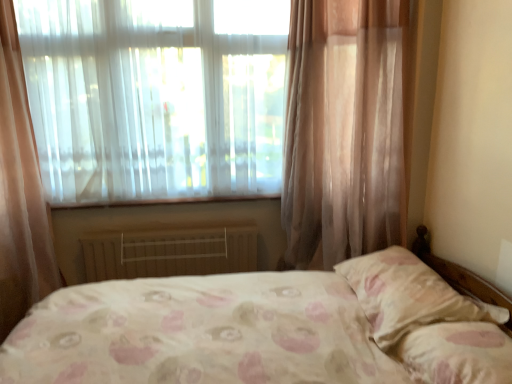
Question: From the image's perspective, relative to translucent fabric at upper left, is pink floral fabric pillow at lower right, the 1th pillow from the front, above or below?

Choices:
 (A) above
 (B) below

Answer: (B)

Question: In the image, is pink floral fabric pillow at lower right, which is the second pillow in back-to-front order, on the left side or the right side of translucent fabric at upper left?

Choices:
 (A) right
 (B) left

Answer: (A)

Question: Considering the real-world distances, which object is farthest from the pink floral fabric pillow at lower right, which is the second pillow in back-to-front order?

Choices:
 (A) pink floral fabric pillow at right, positioned as the first pillow in back-to-front order
 (B) translucent fabric at upper left
 (C) white painted metal radiator at lower center

Answer: (B)

Question: Which of these objects is positioned closest to the white painted metal radiator at lower center?

Choices:
 (A) pink floral fabric pillow at lower right, the 1th pillow from the front
 (B) pink floral fabric pillow at right, the 2th pillow in the front-to-back sequence
 (C) translucent fabric at upper left

Answer: (C)